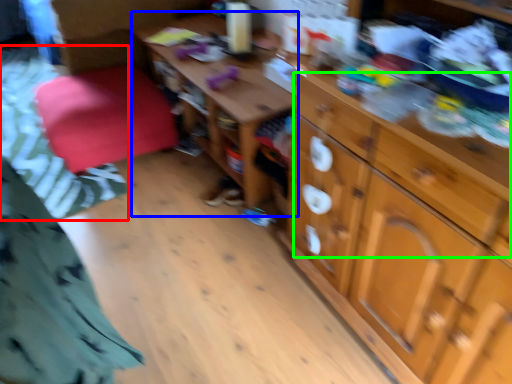
Question: Considering the real-world distances, which object is farthest from bedding (highlighted by a red box)? table (highlighted by a blue box) or drawer (highlighted by a green box)?

Choices:
 (A) table
 (B) drawer

Answer: (B)